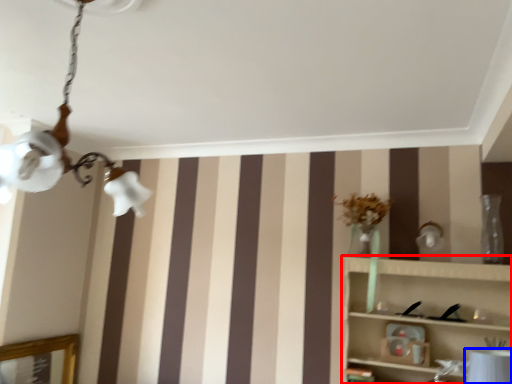
Question: Which of the following is the farthest to the observer, shelf (highlighted by a red box) or table lamp (highlighted by a blue box)?

Choices:
 (A) shelf
 (B) table lamp

Answer: (B)